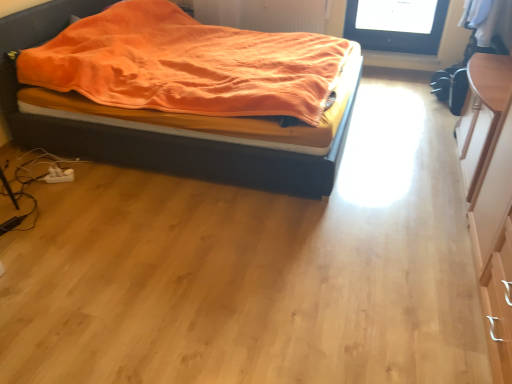
Question: From a real-world perspective, is light wood dresser at right above or below orange soft fabric bed at left?

Choices:
 (A) below
 (B) above

Answer: (B)

Question: Considering their positions, is light wood dresser at right located in front of or behind orange soft fabric bed at left?

Choices:
 (A) behind
 (B) front

Answer: (B)

Question: Is point (494, 205) closer or farther from the camera than point (117, 150)?

Choices:
 (A) closer
 (B) farther

Answer: (A)

Question: From the image's perspective, relative to light wood dresser at right, is orange soft fabric bed at left above or below?

Choices:
 (A) below
 (B) above

Answer: (B)

Question: Based on their positions, is orange soft fabric bed at left located to the left or right of light wood dresser at right?

Choices:
 (A) right
 (B) left

Answer: (B)

Question: Is orange soft fabric bed at left in front of or behind light wood dresser at right in the image?

Choices:
 (A) front
 (B) behind

Answer: (B)

Question: Does point (168, 160) appear closer or farther from the camera than point (506, 236)?

Choices:
 (A) closer
 (B) farther

Answer: (B)